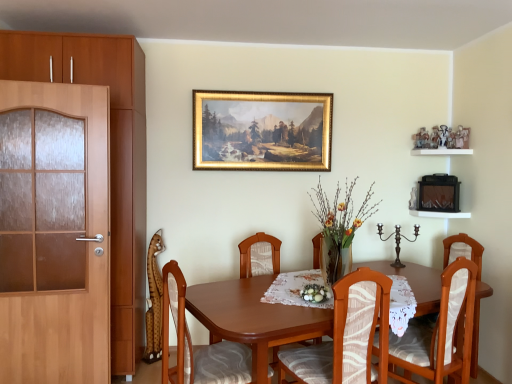
Question: Is wooden chair with patterned cushion at center, the 2th chair from the left, a part of wooden chair with white cushion at center, the 4th chair in the left-to-right sequence?

Choices:
 (A) no
 (B) yes

Answer: (A)

Question: From a real-world perspective, is wooden chair with white cushion at center, the first chair when ordered from right to left, on wooden chair with patterned cushion at center, the 3th chair in the right-to-left sequence?

Choices:
 (A) no
 (B) yes

Answer: (B)

Question: Can you confirm if wooden chair with white cushion at center, the first chair when ordered from right to left, is positioned to the left of wooden chair with patterned cushion at center, the 3th chair in the right-to-left sequence?

Choices:
 (A) yes
 (B) no

Answer: (B)

Question: Is wooden chair with white cushion at center, the first chair when ordered from right to left, shorter than wooden chair with patterned cushion at center, the 2th chair from the left?

Choices:
 (A) yes
 (B) no

Answer: (A)

Question: Considering the relative sizes of wooden chair with white cushion at center, the 4th chair in the left-to-right sequence, and wooden chair with patterned cushion at center, the 3th chair in the right-to-left sequence, in the image provided, is wooden chair with white cushion at center, the 4th chair in the left-to-right sequence, wider than wooden chair with patterned cushion at center, the 3th chair in the right-to-left sequence,?

Choices:
 (A) yes
 (B) no

Answer: (B)

Question: Could you tell me if wooden chair with white cushion at center, the first chair when ordered from right to left, is turned towards wooden chair with patterned cushion at center, the 2th chair from the left?

Choices:
 (A) no
 (B) yes

Answer: (A)

Question: Is white wooden shelf at upper right smaller than wooden chair with patterned cushion at center, the 3th chair in the right-to-left sequence?

Choices:
 (A) yes
 (B) no

Answer: (A)

Question: Is wooden chair with patterned cushion at center, the 2th chair from the left, a part of white wooden shelf at upper right?

Choices:
 (A) yes
 (B) no

Answer: (B)

Question: Considering the relative sizes of white wooden shelf at upper right and wooden chair with patterned cushion at center, the 2th chair from the left, in the image provided, is white wooden shelf at upper right shorter than wooden chair with patterned cushion at center, the 2th chair from the left,?

Choices:
 (A) yes
 (B) no

Answer: (A)

Question: From the image's perspective, is white wooden shelf at upper right located above wooden chair with patterned cushion at center, the 2th chair from the left?

Choices:
 (A) no
 (B) yes

Answer: (B)

Question: Is white wooden shelf at upper right outside wooden chair with patterned cushion at center, the 3th chair in the right-to-left sequence?

Choices:
 (A) no
 (B) yes

Answer: (B)

Question: Is white wooden shelf at upper right looking in the opposite direction of wooden chair with patterned cushion at center, the 2th chair from the left?

Choices:
 (A) yes
 (B) no

Answer: (B)

Question: Does white fabric floral arrangement at center, which is the 2th floral arrangement from top to bottom, appear on the left side of wooden chair with patterned cushion at center, placed as the fourth chair when sorted from right to left?

Choices:
 (A) no
 (B) yes

Answer: (A)